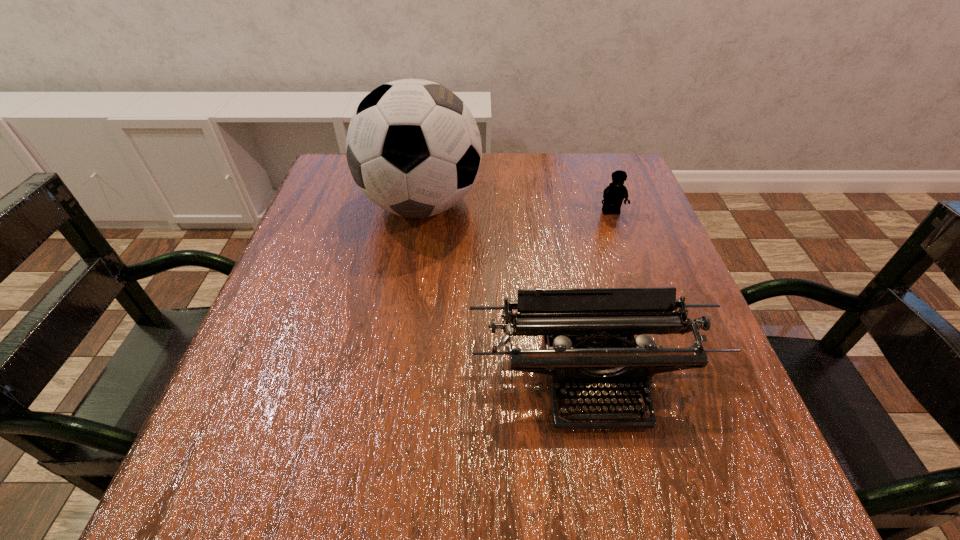
Identify the location of vacant region between the soccer ball and the shortest object. Image resolution: width=960 pixels, height=540 pixels. (516, 209).

You are a GUI agent. You are given a task and a screenshot of the screen. Output one action in this format:
    pyautogui.click(x=<x>, y=<y>)
    Task: Click on the empty space that is in between the shortest object and the tallest object
    
    Given the screenshot: What is the action you would take?
    pyautogui.click(x=516, y=209)

Find the location of a particular element. Image resolution: width=960 pixels, height=540 pixels. free point between the nearest object and the tallest object is located at coordinates (507, 293).

The image size is (960, 540). I want to click on the closest object to the shortest object, so click(x=413, y=147).

I want to click on object that stands as the closest to the nearest object, so click(413, 147).